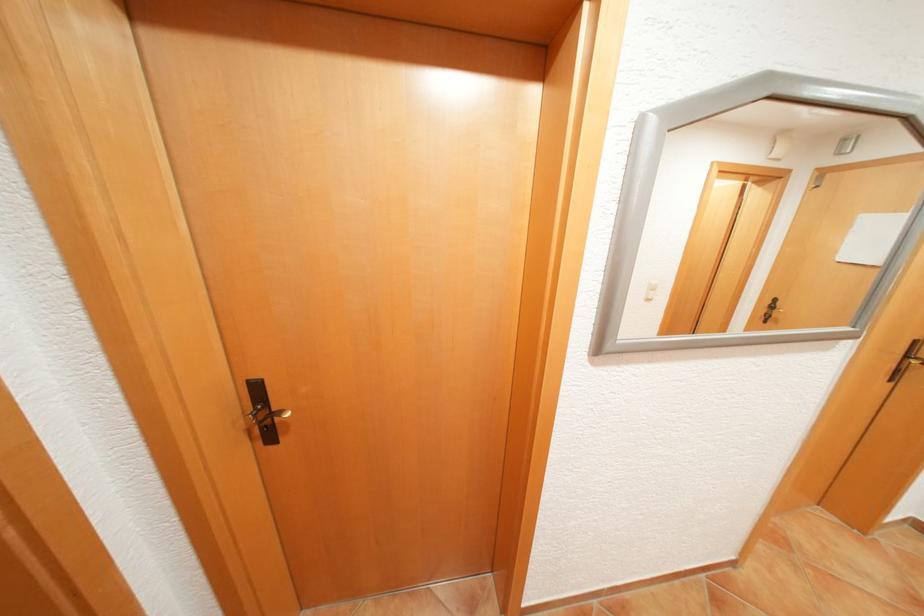
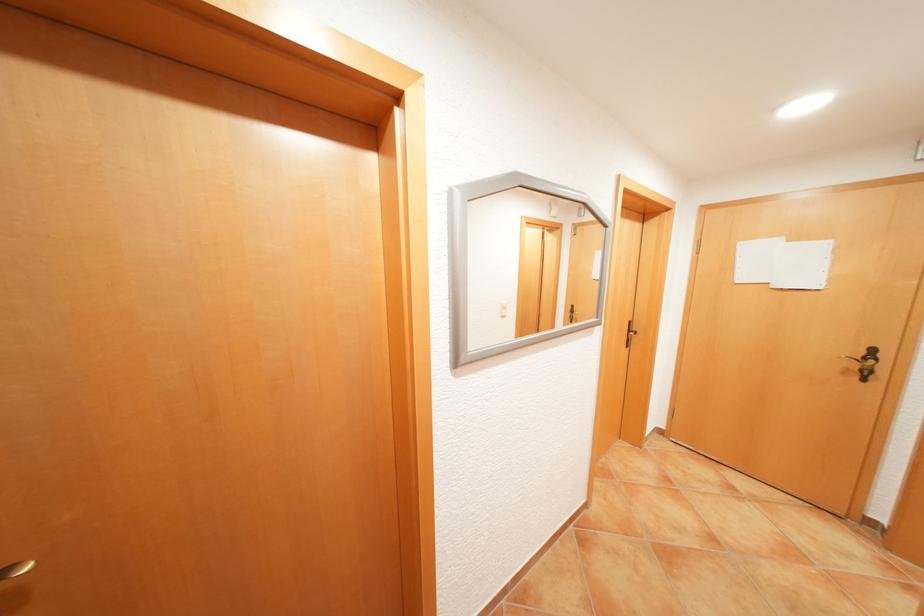
Which direction would the cameraman need to move to produce the second image?

The movement direction of the cameraman is right, backward.